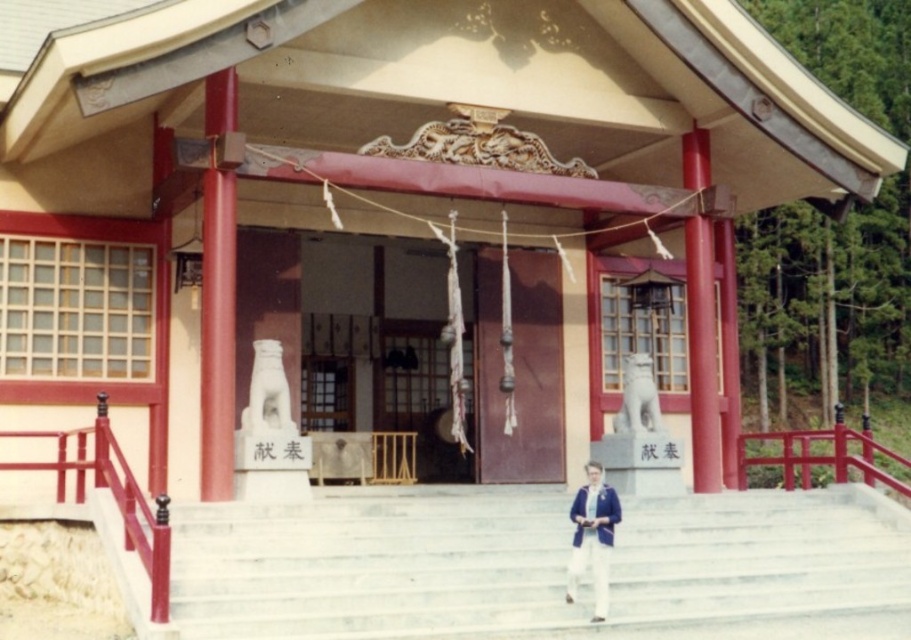
Question: Which point is farther to the camera?

Choices:
 (A) white marble stairs at center
 (B) blue fabric jacket at center

Answer: (B)

Question: Which object appears closest to the camera in this image?

Choices:
 (A) white marble stairs at center
 (B) blue fabric jacket at center

Answer: (A)

Question: Can you confirm if white marble stairs at center is wider than blue fabric jacket at center?

Choices:
 (A) yes
 (B) no

Answer: (A)

Question: Is white marble stairs at center bigger than blue fabric jacket at center?

Choices:
 (A) no
 (B) yes

Answer: (B)

Question: Which point is farther to the camera?

Choices:
 (A) (298, 529)
 (B) (574, 506)

Answer: (B)

Question: Is white marble stairs at center wider than blue fabric jacket at center?

Choices:
 (A) yes
 (B) no

Answer: (A)